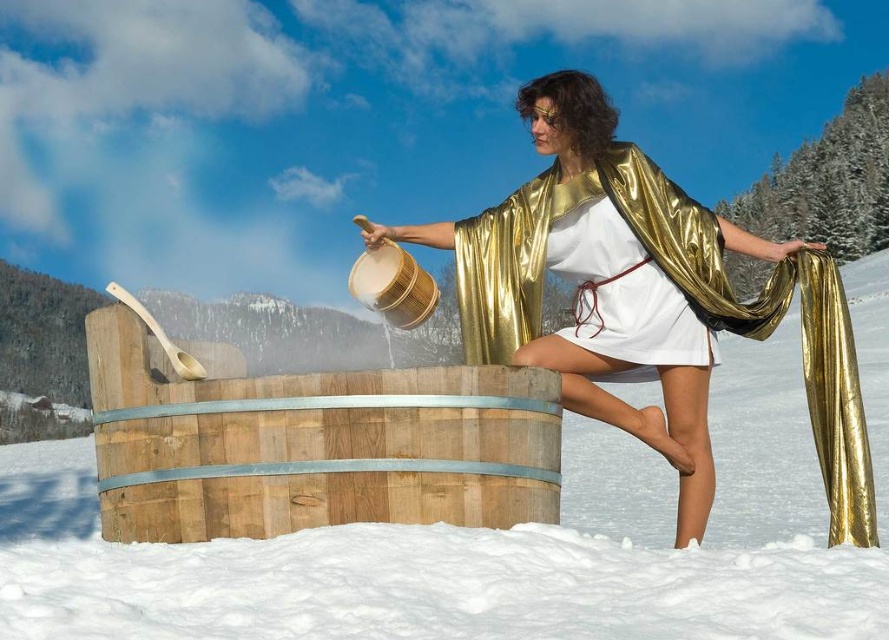
Is white fluffy snow at center bigger than metallic gold robe at center?

Correct, white fluffy snow at center is larger in size than metallic gold robe at center.

Measure the distance between point (735, 337) and camera.

A distance of 22.51 meters exists between point (735, 337) and camera.

This screenshot has height=640, width=889. I want to click on white fluffy snow at center, so click(x=498, y=540).

Is white fluffy snow at center closer to the viewer compared to natural wood barrel at lower center?

That is True.

This screenshot has width=889, height=640. What do you see at coordinates (498, 540) in the screenshot?
I see `white fluffy snow at center` at bounding box center [498, 540].

Is point (777, 392) positioned behind point (119, 483)?

Yes, it is behind point (119, 483).

Identify the location of white fluffy snow at center. (498, 540).

Does natural wood barrel at lower center have a larger size compared to metallic gold robe at center?

Actually, natural wood barrel at lower center might be smaller than metallic gold robe at center.

Is natural wood barrel at lower center in front of metallic gold robe at center?

That is True.

Locate an element on the screen. Image resolution: width=889 pixels, height=640 pixels. natural wood barrel at lower center is located at coordinates (313, 445).